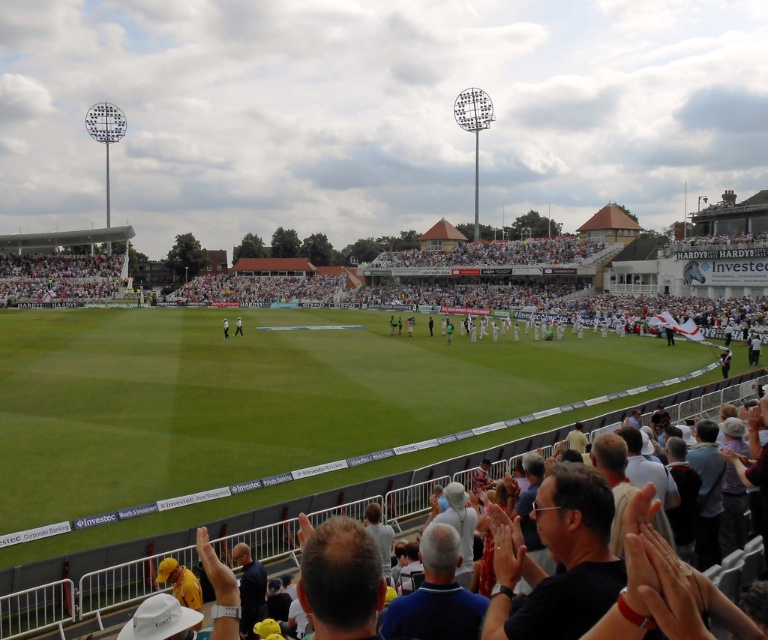
Question: Which point is farther from the camera taking this photo?

Choices:
 (A) [25, 300]
 (B) [227, 332]

Answer: (A)

Question: Considering the real-world distances, which object is closest to the white fabric crowd at upper left?

Choices:
 (A) light brown leather jacket at center
 (B) white fabric person at center

Answer: (B)

Question: Does light brown leather jacket at center appear on the left side of white fabric person at center?

Choices:
 (A) yes
 (B) no

Answer: (B)

Question: Is white fabric crowd at upper left behind light brown leather jacket at center?

Choices:
 (A) yes
 (B) no

Answer: (A)

Question: Is light brown leather jacket at center smaller than white fabric person at center?

Choices:
 (A) no
 (B) yes

Answer: (B)

Question: Which object is positioned farthest from the white fabric crowd at upper left?

Choices:
 (A) white fabric person at center
 (B) light brown leather jacket at center

Answer: (B)